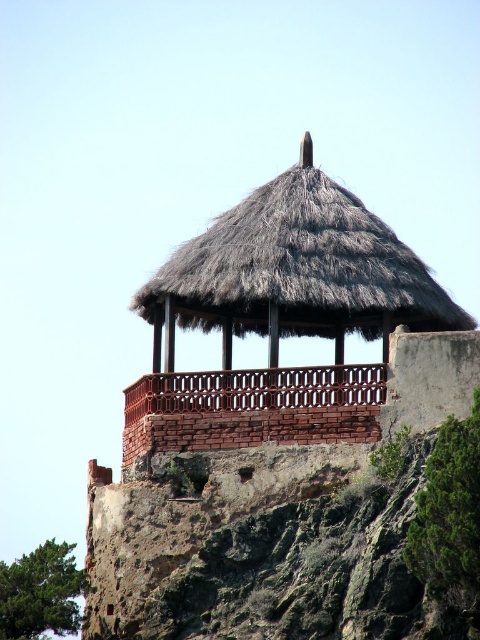
You are standing on the red brick balcony at upper center and want to reach the thatched wood gazebo at upper center. Which direction should you move to get there?

The thatched wood gazebo at upper center is above the red brick balcony at upper center, so you should move upward to reach it.

You are an architect planning to install a new lighting system for the thatched wood gazebo at upper center and the red brick balcony at upper center. Based on their heights, which structure requires a taller ladder to reach its roof?

The thatched wood gazebo at upper center requires a taller ladder because it is taller than the red brick balcony at upper center.

You are standing at the base of the rustic pavilion and looking towards the rocky outcrop. There are two points marked in the scene. Which point is closer to you, point (232, 214) or point (178, 392)?

Point (178, 392) is closer to you since it is in front of point (232, 214).